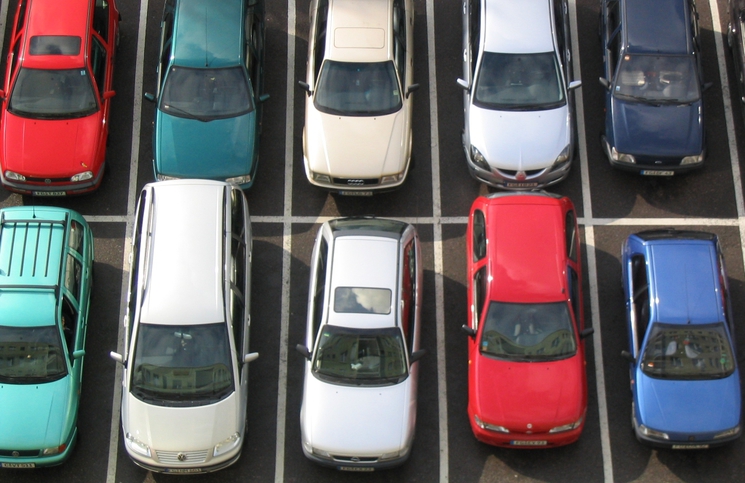
The height and width of the screenshot is (483, 745). In order to click on hood in this screenshot , I will do `click(679, 408)`, `click(545, 395)`, `click(363, 411)`, `click(197, 424)`, `click(13, 418)`, `click(36, 129)`, `click(205, 135)`, `click(370, 135)`, `click(516, 133)`, `click(641, 138)`.